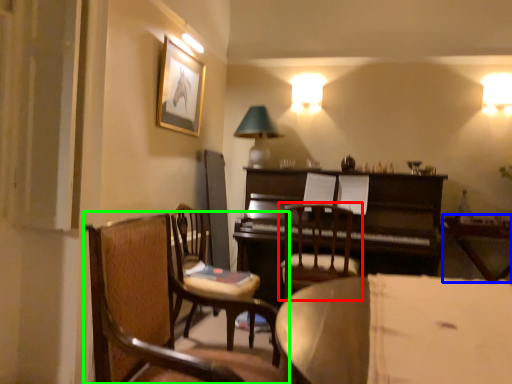
Question: Which object is positioned closest to chair (highlighted by a red box)? Select from table (highlighted by a blue box) and chair (highlighted by a green box).

Choices:
 (A) table
 (B) chair

Answer: (A)